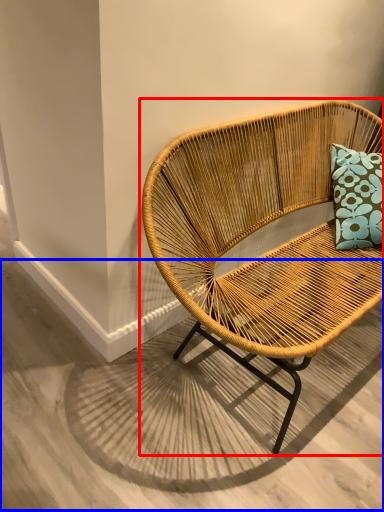
Question: Which of the following is the closest to the observer, chair (highlighted by a red box) or concrete (highlighted by a blue box)?

Choices:
 (A) chair
 (B) concrete

Answer: (A)